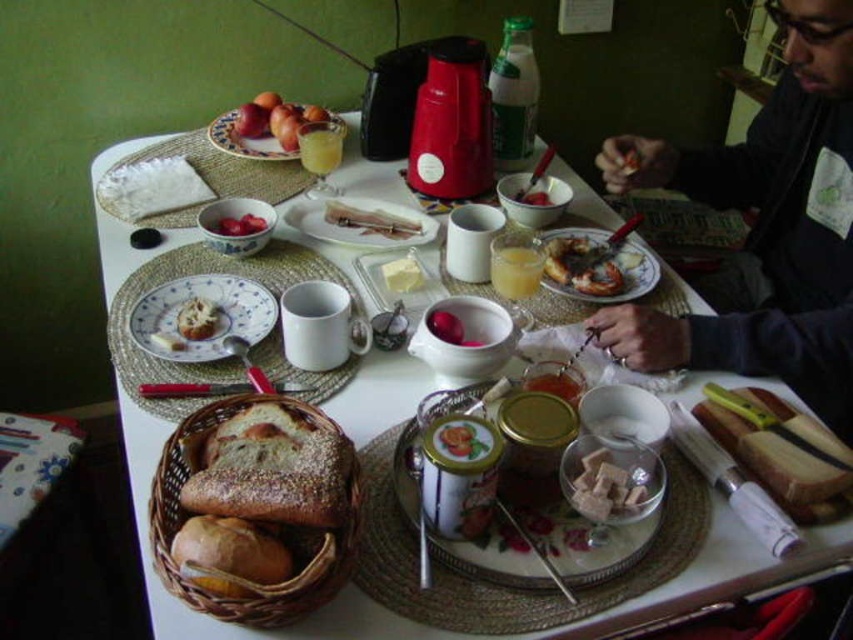
Is matte white table at center to the left of porcelain plate with fruit at upper left from the viewer's perspective?

Incorrect, matte white table at center is not on the left side of porcelain plate with fruit at upper left.

Which is behind, point (345, 400) or point (231, 150)?

Point (231, 150)

The height and width of the screenshot is (640, 853). I want to click on matte white table at center, so click(x=469, y=634).

The width and height of the screenshot is (853, 640). I want to click on golden crusty bread at lower left, so point(229,556).

Can you confirm if golden crusty bread at lower left is positioned to the left of white creamy butter at center?

Indeed, golden crusty bread at lower left is positioned on the left side of white creamy butter at center.

Who is more forward, (x=204, y=545) or (x=405, y=273)?

Point (x=204, y=545) is in front.

Find the location of a particular element. The width and height of the screenshot is (853, 640). golden crusty bread at lower left is located at coordinates (229, 556).

Which is below, matte white table at center or white glossy bread at center?

Positioned lower is matte white table at center.

Who is more forward, (601, 612) or (349, 211)?

Point (601, 612) is in front.

Does point (148, 465) come farther from viewer compared to point (341, 218)?

No, it is not.

Find the location of `matte white table at center`. matte white table at center is located at coordinates (469, 634).